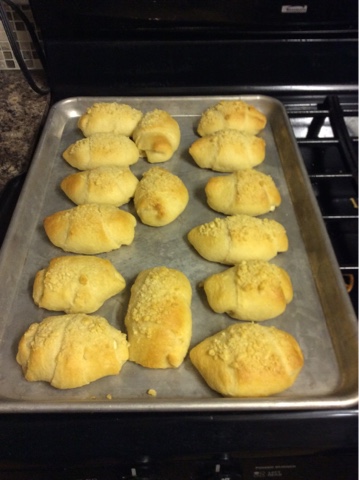
This screenshot has width=359, height=480. Find the location of `rack`. rack is located at coordinates (350, 150).